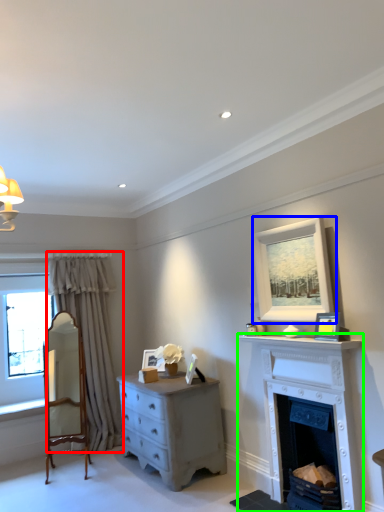
Question: Considering the real-world distances, which object is farthest from curtain (highlighted by a red box)? picture frame (highlighted by a blue box) or fireplace (highlighted by a green box)?

Choices:
 (A) picture frame
 (B) fireplace

Answer: (A)